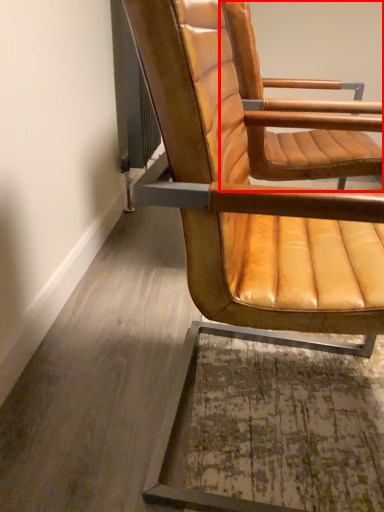
Question: From the image's perspective, what is the correct spatial positioning of chair (annotated by the red box) in reference to chair?

Choices:
 (A) above
 (B) below

Answer: (A)